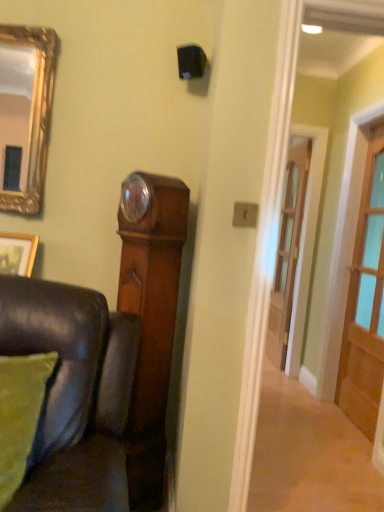
Where is `wooden picture frame at lower left`? This screenshot has height=512, width=384. wooden picture frame at lower left is located at coordinates [17, 253].

The height and width of the screenshot is (512, 384). What are the coordinates of `wooden door at center, the 2th door viewed from the right` in the screenshot? It's located at (288, 250).

What do you see at coordinates (288, 250) in the screenshot?
I see `wooden door at center, the 1th door positioned from the back` at bounding box center [288, 250].

You are a GUI agent. You are given a task and a screenshot of the screen. Output one action in this format:
    pyautogui.click(x=<x>, y=<y>)
    Task: Click on the wooden door at right, marked as the first door in a right-to-left arrangement
    
    Given the screenshot: What is the action you would take?
    pyautogui.click(x=365, y=303)

Does wooden door at right, marked as the first door in a right-to-left arrangement, contain wooden door at center, arranged as the 1th door when viewed from the left?

That's incorrect, wooden door at center, arranged as the 1th door when viewed from the left, is not inside wooden door at right, marked as the first door in a right-to-left arrangement.

Considering the sizes of objects wooden door at right, acting as the 2th door starting from the back, and wooden door at center, the 2th door viewed from the right, in the image provided, who is wider, wooden door at right, acting as the 2th door starting from the back, or wooden door at center, the 2th door viewed from the right,?

With larger width is wooden door at right, acting as the 2th door starting from the back.

Is wooden door at right, which is counted as the 2th door, starting from the left, facing towards wooden door at center, the 2th door viewed from the right?

No, wooden door at right, which is counted as the 2th door, starting from the left, is not aimed at wooden door at center, the 2th door viewed from the right.

Is the depth of wooden door at right, acting as the 2th door starting from the back, greater than that of wooden door at center, the second door from the front?

That is False.

From a real-world perspective, is wooden door at center, the 2th door viewed from the right, physically located above or below wooden door at right, which is counted as the 2th door, starting from the left?

wooden door at center, the 2th door viewed from the right, is below wooden door at right, which is counted as the 2th door, starting from the left.

Based on the photo, is wooden door at center, the 2th door viewed from the right, positioned with its back to wooden door at right, acting as the 2th door starting from the back?

No, wooden door at right, acting as the 2th door starting from the back, is not at the back of wooden door at center, the 2th door viewed from the right.

Which is farther, (292, 217) or (368, 373)?

The point (292, 217) is more distant.

Is wooden door at center, the 2th door viewed from the right, spatially inside wooden door at right, the first door positioned from the front, or outside of it?

wooden door at center, the 2th door viewed from the right, is not inside wooden door at right, the first door positioned from the front, it's outside.

Are wooden door at right, acting as the 2th door starting from the back, and wooden picture frame at lower left located far from each other?

Yes, wooden door at right, acting as the 2th door starting from the back, and wooden picture frame at lower left are located far from each other.

How different are the orientations of wooden door at right, which is counted as the 2th door, starting from the left, and wooden picture frame at lower left in degrees?

90.2 degrees.

The height and width of the screenshot is (512, 384). I want to click on picture frame that appears on the left of wooden door at right, which is counted as the 2th door, starting from the left, so click(x=17, y=253).

Is wooden door at right, marked as the first door in a right-to-left arrangement, positioned before wooden picture frame at lower left?

No, it is not.

Considering the sizes of wooden door at center, the 1th door positioned from the back, and wooden picture frame at lower left in the image, is wooden door at center, the 1th door positioned from the back, taller or shorter than wooden picture frame at lower left?

wooden door at center, the 1th door positioned from the back, is taller than wooden picture frame at lower left.

How far apart are wooden door at center, arranged as the 1th door when viewed from the left, and wooden picture frame at lower left?

They are 2.45 meters apart.

Is the surface of wooden door at center, the 1th door positioned from the back, in direct contact with wooden picture frame at lower left?

No, wooden door at center, the 1th door positioned from the back, is not in contact with wooden picture frame at lower left.

From the image's perspective, does wooden door at center, arranged as the 1th door when viewed from the left, appear lower than wooden picture frame at lower left?

Actually, wooden door at center, arranged as the 1th door when viewed from the left, appears above wooden picture frame at lower left in the image.

In the scene shown: Could you tell me if green fabric pillow at lower left is turned towards wooden picture frame at lower left?

No, green fabric pillow at lower left is not oriented towards wooden picture frame at lower left.

From a real-world perspective, between green fabric pillow at lower left and wooden picture frame at lower left, who is vertically lower?

green fabric pillow at lower left.

From the image's perspective, would you say green fabric pillow at lower left is shown under wooden picture frame at lower left?

Yes, from the image's perspective, green fabric pillow at lower left is below wooden picture frame at lower left.

From the image's perspective, is green fabric pillow at lower left located above or below wooden door at right, marked as the first door in a right-to-left arrangement?

From the image's perspective, green fabric pillow at lower left appears below wooden door at right, marked as the first door in a right-to-left arrangement.

From a real-world perspective, which is physically below, green fabric pillow at lower left or wooden door at right, which is counted as the 2th door, starting from the left?

green fabric pillow at lower left is physically lower.

Looking at the image, does green fabric pillow at lower left seem bigger or smaller compared to wooden door at right, acting as the 2th door starting from the back?

Clearly, green fabric pillow at lower left is smaller in size than wooden door at right, acting as the 2th door starting from the back.

Is green fabric pillow at lower left oriented away from wooden door at right, which is counted as the 2th door, starting from the left?

green fabric pillow at lower left does not have its back to wooden door at right, which is counted as the 2th door, starting from the left.

From the image's perspective, which one is positioned lower, wooden picture frame at lower left or wooden door at center, the second door from the front?

wooden picture frame at lower left, from the image's perspective.

Considering the sizes of objects wooden picture frame at lower left and wooden door at center, arranged as the 1th door when viewed from the left, in the image provided, who is shorter, wooden picture frame at lower left or wooden door at center, arranged as the 1th door when viewed from the left,?

With less height is wooden picture frame at lower left.

How distant is wooden picture frame at lower left from wooden door at center, the 2th door viewed from the right?

The distance of wooden picture frame at lower left from wooden door at center, the 2th door viewed from the right, is 8.04 feet.

I want to click on picture frame below the wooden door at center, the 1th door positioned from the back (from the image's perspective), so pos(17,253).

Find the location of a particular element. Image resolution: width=384 pixels, height=512 pixels. door above the wooden door at center, the 1th door positioned from the back (from a real-world perspective) is located at coordinates (365, 303).

Find the location of a particular element. door that appears on the left of wooden door at right, marked as the first door in a right-to-left arrangement is located at coordinates (288, 250).

Based on their spatial positions, is green fabric pillow at lower left or wooden door at center, the 2th door viewed from the right, further from wooden door at right, acting as the 2th door starting from the back?

green fabric pillow at lower left lies further to wooden door at right, acting as the 2th door starting from the back, than the other object.

Based on their spatial positions, is wooden picture frame at lower left or green fabric pillow at lower left closer to wooden door at center, the 1th door positioned from the back?

Based on the image, wooden picture frame at lower left appears to be nearer to wooden door at center, the 1th door positioned from the back.

From the picture: When comparing their distances from green fabric pillow at lower left, does wooden picture frame at lower left or wooden door at center, the 1th door positioned from the back, seem closer?

Based on the image, wooden picture frame at lower left appears to be nearer to green fabric pillow at lower left.

Looking at this image, which object lies further to the anchor point wooden picture frame at lower left, wooden door at right, marked as the first door in a right-to-left arrangement, or wooden door at center, the 1th door positioned from the back?

wooden door at center, the 1th door positioned from the back, is positioned further to the anchor wooden picture frame at lower left.

Looking at the image, which one is located closer to wooden picture frame at lower left, wooden door at right, marked as the first door in a right-to-left arrangement, or green fabric pillow at lower left?

green fabric pillow at lower left lies closer to wooden picture frame at lower left than the other object.

Looking at this image, considering their positions, is wooden door at center, the 2th door viewed from the right, positioned closer to green fabric pillow at lower left than wooden door at right, acting as the 2th door starting from the back?

The object closer to green fabric pillow at lower left is wooden door at right, acting as the 2th door starting from the back.

Looking at the image, which one is located closer to wooden door at center, the second door from the front, green fabric pillow at lower left or wooden door at right, marked as the first door in a right-to-left arrangement?

The object closer to wooden door at center, the second door from the front, is wooden door at right, marked as the first door in a right-to-left arrangement.

Estimate the real-world distances between objects in this image. Which object is further from green fabric pillow at lower left, wooden door at right, the first door positioned from the front, or wooden door at center, the 1th door positioned from the back?

wooden door at center, the 1th door positioned from the back, is positioned further to the anchor green fabric pillow at lower left.

The height and width of the screenshot is (512, 384). In order to click on door situated between wooden picture frame at lower left and wooden door at right, which is counted as the 2th door, starting from the left, from left to right in this screenshot , I will do `click(288, 250)`.

At what (x,y) coordinates should I click in order to perform the action: click on picture frame between green fabric pillow at lower left and wooden door at center, the 2th door viewed from the right, from front to back. Please return your answer as a coordinate pair (x, y). The height and width of the screenshot is (512, 384). Looking at the image, I should click on (17, 253).

Identify the location of door positioned between green fabric pillow at lower left and wooden door at center, the second door from the front, from near to far. This screenshot has width=384, height=512. (365, 303).

Image resolution: width=384 pixels, height=512 pixels. In order to click on pillow between wooden picture frame at lower left and wooden door at right, the first door positioned from the front in this screenshot , I will do `click(20, 414)`.